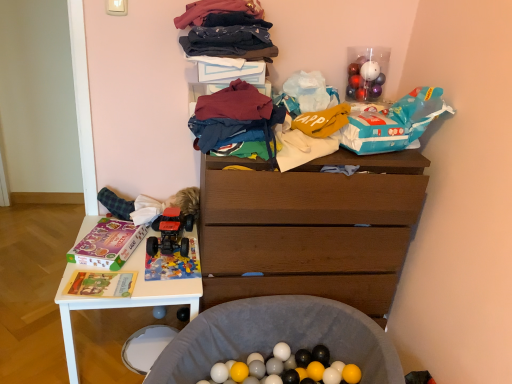
Describe the element at coordinates (236, 119) in the screenshot. I see `maroon fabric at center, acting as the first clothing starting from the bottom` at that location.

What do you see at coordinates (101, 284) in the screenshot? The image size is (512, 384). I see `matte yellow book at lower left, positioned as the second magazine in top-to-bottom order` at bounding box center [101, 284].

You are a GUI agent. You are given a task and a screenshot of the screen. Output one action in this format:
    pyautogui.click(x=<x>, y=<y>)
    Task: Click on the soft cotton clothes at upper center
    Image resolution: width=512 pixels, height=384 pixels.
    Given the screenshot: What is the action you would take?
    pyautogui.click(x=227, y=30)

What is the approximate height of dark blue cotton socks at upper center, positioned as the first clothing in top-to-bottom order?

dark blue cotton socks at upper center, positioned as the first clothing in top-to-bottom order, is 2.88 inches tall.

What is the approximate width of wooden chest of drawers at center?

The width of wooden chest of drawers at center is 21.18 inches.

Find the location of a particular element. This screenshot has height=384, width=512. maroon fabric at center, acting as the first clothing starting from the bottom is located at coordinates (236, 119).

Considering the sizes of wooden chest of drawers at center and rubberized red truck at lower left in the image, is wooden chest of drawers at center taller or shorter than rubberized red truck at lower left?

wooden chest of drawers at center is taller than rubberized red truck at lower left.

Which object is thinner, wooden chest of drawers at center or rubberized red truck at lower left?

rubberized red truck at lower left.

Can you confirm if wooden chest of drawers at center is smaller than rubberized red truck at lower left?

Actually, wooden chest of drawers at center might be larger than rubberized red truck at lower left.

In terms of height, does wooden chest of drawers at center look taller or shorter compared to soft cotton clothes at upper center?

wooden chest of drawers at center is taller than soft cotton clothes at upper center.

Would you say soft cotton clothes at upper center is part of wooden chest of drawers at center's contents?

No, soft cotton clothes at upper center is not inside wooden chest of drawers at center.

Is wooden chest of drawers at center far away from soft cotton clothes at upper center?

Actually, wooden chest of drawers at center and soft cotton clothes at upper center are a little close together.

Which object is thinner, maroon fabric at center, which appears as the second clothing when viewed from the top, or wooden chest of drawers at center?

maroon fabric at center, which appears as the second clothing when viewed from the top.

Where is `the chest of drawers lying behind the maroon fabric at center, acting as the first clothing starting from the bottom`? This screenshot has width=512, height=384. the chest of drawers lying behind the maroon fabric at center, acting as the first clothing starting from the bottom is located at coordinates (308, 232).

Looking at this image, how many degrees apart are the facing directions of maroon fabric at center, acting as the first clothing starting from the bottom, and wooden chest of drawers at center?

The facing directions of maroon fabric at center, acting as the first clothing starting from the bottom, and wooden chest of drawers at center are 0.828 degrees apart.

Between point (259, 101) and point (351, 196), which one is positioned in front?

Positioned in front is point (259, 101).

Looking at this image, looking at the image, does maroon fabric at center, acting as the first clothing starting from the bottom, seem bigger or smaller compared to rubberized red truck at lower left?

Clearly, maroon fabric at center, acting as the first clothing starting from the bottom, is larger in size than rubberized red truck at lower left.

How much distance is there between maroon fabric at center, acting as the first clothing starting from the bottom, and rubberized red truck at lower left?

The distance of maroon fabric at center, acting as the first clothing starting from the bottom, from rubberized red truck at lower left is 22.74 inches.

Does maroon fabric at center, acting as the first clothing starting from the bottom, turn towards rubberized red truck at lower left?

No, maroon fabric at center, acting as the first clothing starting from the bottom, is not turned towards rubberized red truck at lower left.

Is point (274, 307) closer or farther from the camera than point (147, 243)?

Point (274, 307) is positioned closer to the camera compared to point (147, 243).

Is soft gray fabric ball pit at lower center, which is counted as the 1th waste, starting from the bottom, in front of or behind rubberized red truck at lower left in the image?

In the image, soft gray fabric ball pit at lower center, which is counted as the 1th waste, starting from the bottom, appears in front of rubberized red truck at lower left.

Can you confirm if soft gray fabric ball pit at lower center, which is counted as the 1th waste, starting from the bottom, is shorter than rubberized red truck at lower left?

In fact, soft gray fabric ball pit at lower center, which is counted as the 1th waste, starting from the bottom, may be taller than rubberized red truck at lower left.

Does soft gray fabric ball pit at lower center, which is counted as the 1th waste, starting from the bottom, have a greater width compared to dark blue cotton socks at upper center, marked as the second clothing in a bottom-to-top arrangement?

Yes.

From the image's perspective, does soft gray fabric ball pit at lower center, the 2th waste positioned from the top, appear higher than dark blue cotton socks at upper center, positioned as the first clothing in top-to-bottom order?

No, from the image's perspective, soft gray fabric ball pit at lower center, the 2th waste positioned from the top, is not above dark blue cotton socks at upper center, positioned as the first clothing in top-to-bottom order.

Consider the image. Is soft gray fabric ball pit at lower center, which is counted as the 1th waste, starting from the bottom, surrounding dark blue cotton socks at upper center, positioned as the first clothing in top-to-bottom order?

That's incorrect, dark blue cotton socks at upper center, positioned as the first clothing in top-to-bottom order, is not inside soft gray fabric ball pit at lower center, which is counted as the 1th waste, starting from the bottom.

You are a GUI agent. You are given a task and a screenshot of the screen. Output one action in this format:
    pyautogui.click(x=<x>, y=<y>)
    Task: Click on the 2nd clothing above the soft gray fabric ball pit at lower center, which is counted as the 1th waste, starting from the bottom (from the image's perspective)
    The image size is (512, 384).
    Given the screenshot: What is the action you would take?
    click(225, 41)

Can you confirm if dark blue cotton socks at upper center, marked as the second clothing in a bottom-to-top arrangement, is positioned to the right of fluffy green fabric at left?

Yes.

Can you tell me how much dark blue cotton socks at upper center, marked as the second clothing in a bottom-to-top arrangement, and fluffy green fabric at left differ in facing direction?

The angular difference between dark blue cotton socks at upper center, marked as the second clothing in a bottom-to-top arrangement, and fluffy green fabric at left is 11.8 degrees.

Which is behind, point (254, 50) or point (111, 203)?

Positioned behind is point (111, 203).

Looking at this image, between dark blue cotton socks at upper center, marked as the second clothing in a bottom-to-top arrangement, and fluffy green fabric at left, which one has smaller width?

dark blue cotton socks at upper center, marked as the second clothing in a bottom-to-top arrangement.

Find the location of a particular element. This screenshot has height=384, width=512. toy lying behind the wooden chest of drawers at center is located at coordinates (170, 233).

Where is `laundry in front of the wooden chest of drawers at center`? This screenshot has height=384, width=512. laundry in front of the wooden chest of drawers at center is located at coordinates (227, 30).

Considering their positions, is rubberized red truck at lower left positioned further to white plastic desk at lower left than maroon fabric at center, which appears as the second clothing when viewed from the top?

Based on the image, maroon fabric at center, which appears as the second clothing when viewed from the top, appears to be further to white plastic desk at lower left.

Which object lies nearer to the anchor point white plastic desk at lower left, fluffy green fabric at left or blue plastic bag at upper right, which is counted as the second waste, starting from the bottom?

fluffy green fabric at left is positioned closer to the anchor white plastic desk at lower left.

Considering their positions, is maroon fabric at center, which appears as the second clothing when viewed from the top, positioned further to fluffy green fabric at left than matte yellow book at lower left, marked as the second magazine in a back-to-front arrangement?

maroon fabric at center, which appears as the second clothing when viewed from the top, is further to fluffy green fabric at left.

Considering their positions, is blue plastic bag at upper right, the first waste viewed from the top, positioned further to rubberized red truck at lower left than maroon fabric at center, acting as the first clothing starting from the bottom?

blue plastic bag at upper right, the first waste viewed from the top, lies further to rubberized red truck at lower left than the other object.

Which object lies nearer to the anchor point soft cotton clothes at upper center, matte yellow book at lower left, acting as the first magazine starting from the front, or matte purple magazine at left, the 2th magazine in the front-to-back sequence?

The object closer to soft cotton clothes at upper center is matte purple magazine at left, the 2th magazine in the front-to-back sequence.

Consider the image. From the image, which object appears to be farther from soft cotton clothes at upper center, matte purple magazine at left, which ranks as the first magazine in back-to-front order, or soft gray fabric ball pit at lower center, which is counted as the 1th waste, starting from the bottom?

Based on the image, soft gray fabric ball pit at lower center, which is counted as the 1th waste, starting from the bottom, appears to be further to soft cotton clothes at upper center.

Based on their spatial positions, is white plastic desk at lower left or matte yellow book at lower left, arranged as the first magazine when ordered from the bottom, closer to maroon fabric at center, which appears as the second clothing when viewed from the top?

Among the two, white plastic desk at lower left is located nearer to maroon fabric at center, which appears as the second clothing when viewed from the top.

Looking at the image, which one is located further to matte yellow book at lower left, acting as the first magazine starting from the front, soft gray fabric ball pit at lower center, which is counted as the 1th waste, starting from the bottom, or fluffy green fabric at left?

soft gray fabric ball pit at lower center, which is counted as the 1th waste, starting from the bottom.

Where is `the chest of drawers between dark blue cotton socks at upper center, positioned as the first clothing in top-to-bottom order, and soft gray fabric ball pit at lower center, the 2th waste positioned from the top, vertically`? The image size is (512, 384). the chest of drawers between dark blue cotton socks at upper center, positioned as the first clothing in top-to-bottom order, and soft gray fabric ball pit at lower center, the 2th waste positioned from the top, vertically is located at coordinates (308, 232).

The width and height of the screenshot is (512, 384). I want to click on toy between soft cotton clothes at upper center and soft gray fabric ball pit at lower center, the 2th waste positioned from the top, from top to bottom, so click(x=170, y=233).

Locate an element on the screen. This screenshot has height=384, width=512. child that lies between maroon fabric at center, which appears as the second clothing when viewed from the top, and soft gray fabric ball pit at lower center, the 2th waste positioned from the top, from top to bottom is located at coordinates click(x=122, y=203).

Image resolution: width=512 pixels, height=384 pixels. Find the location of `desk between maroon fabric at center, which appears as the second clothing when viewed from the top, and soft gray fabric ball pit at lower center, the 2th waste positioned from the top, vertically`. desk between maroon fabric at center, which appears as the second clothing when viewed from the top, and soft gray fabric ball pit at lower center, the 2th waste positioned from the top, vertically is located at coordinates (124, 299).